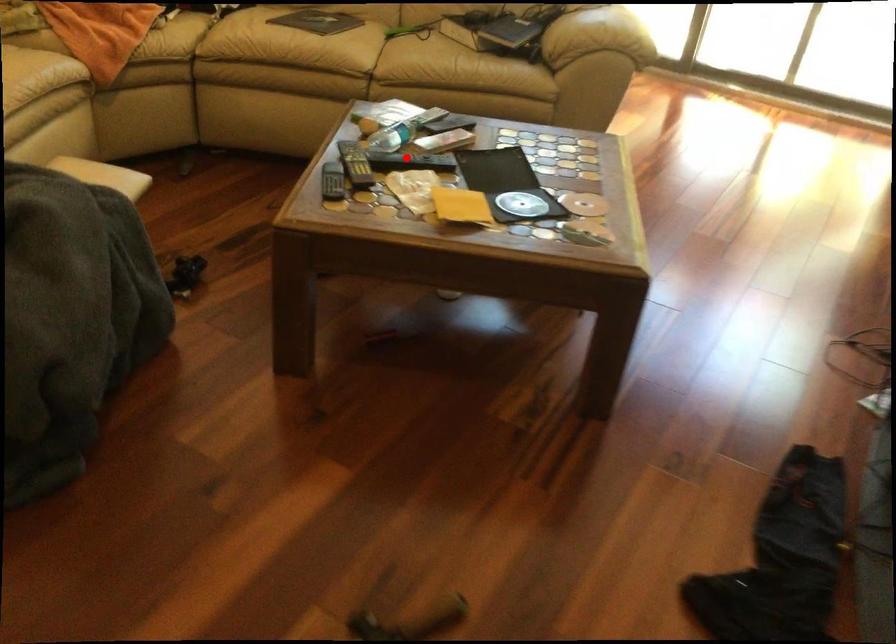
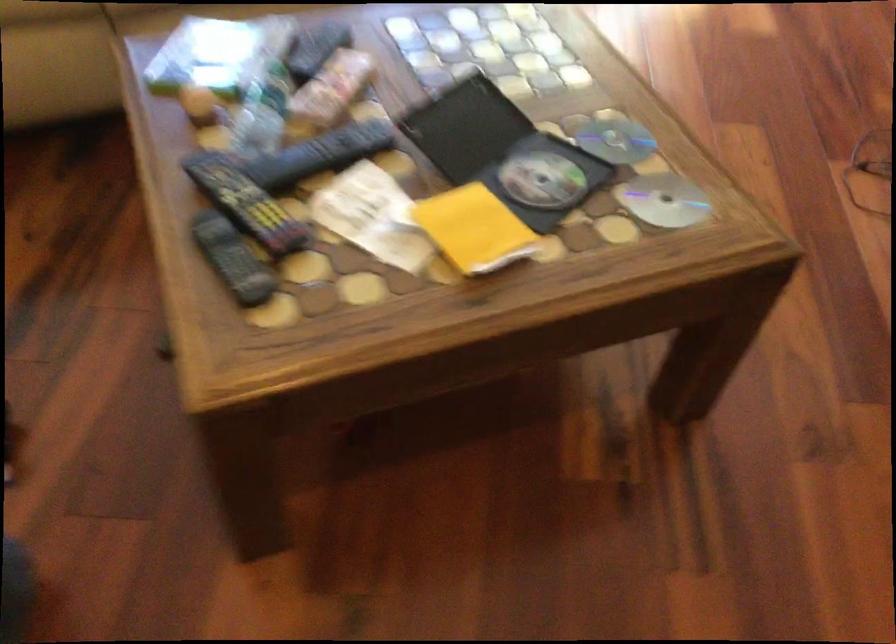
In the second image, find the point that corresponds to the highlighted location in the first image.

(320, 154)